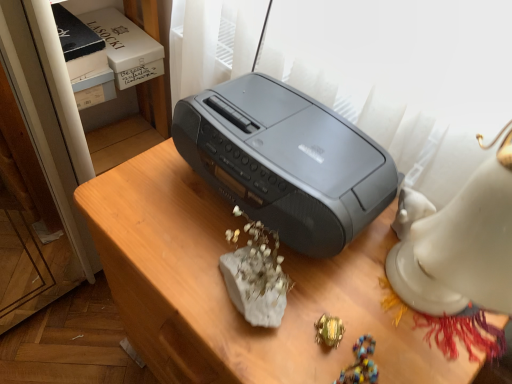
Locate an element on the screen. The height and width of the screenshot is (384, 512). vacant area located to the right-hand side of green metallic ring at lower center is located at coordinates (409, 332).